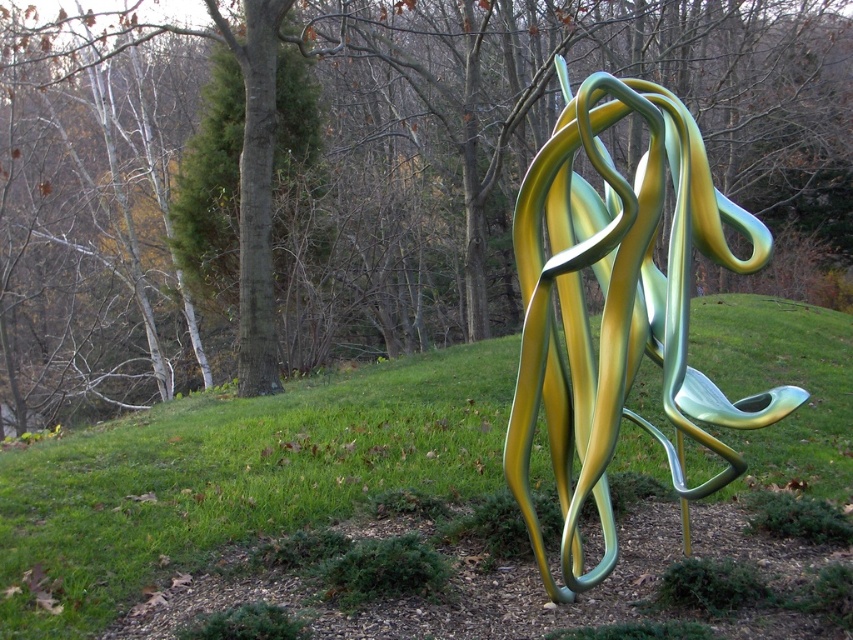
You are a landscape architect designing a garden and want to place a new statue in the center. The statue will be placed where the metallic green and yellow sculpture at center is currently located. However, you need to ensure that the statue won not be completely hidden by the green grass at center. Based on the scene, will the statue be visible from above? Explain your reasoning.

The green grass at center is larger in size than the metallic green and yellow sculpture at center. Since the grass is larger, it might grow around or over the sculpture, potentially hiding it from view. To ensure visibility from above, the statue should be elevated or the grass kept trimmed around its base.

You are a photographer standing in the middle of the grassy hillside. You want to take a photo of the metallic green and yellow sculpture at center without the green matte tree at center blocking it. Is the sculpture visible from your current position?

The green matte tree at center is located above the metallic green and yellow sculpture at center, so the tree may block part of the sculpture in your photo. Adjust your angle or position to ensure the sculpture is fully visible.